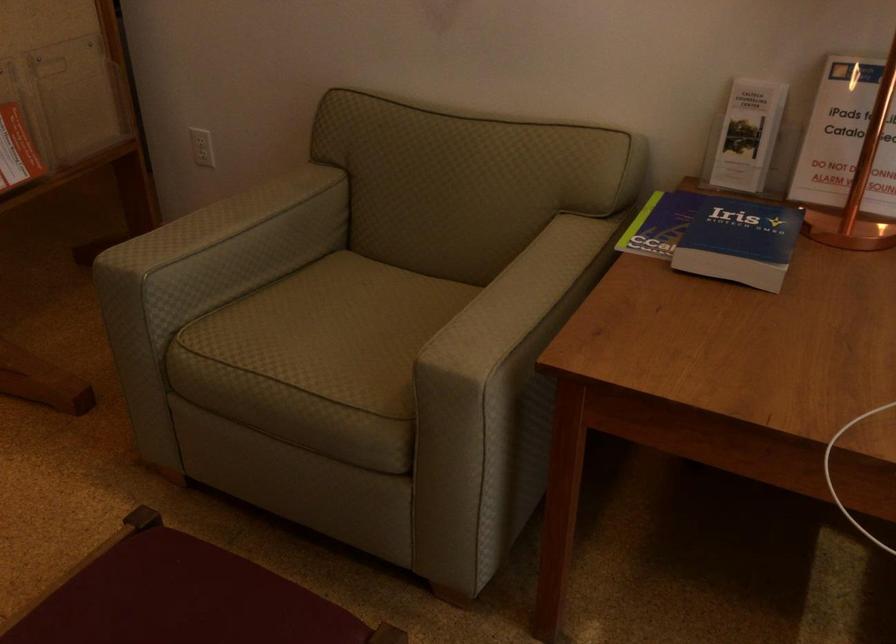
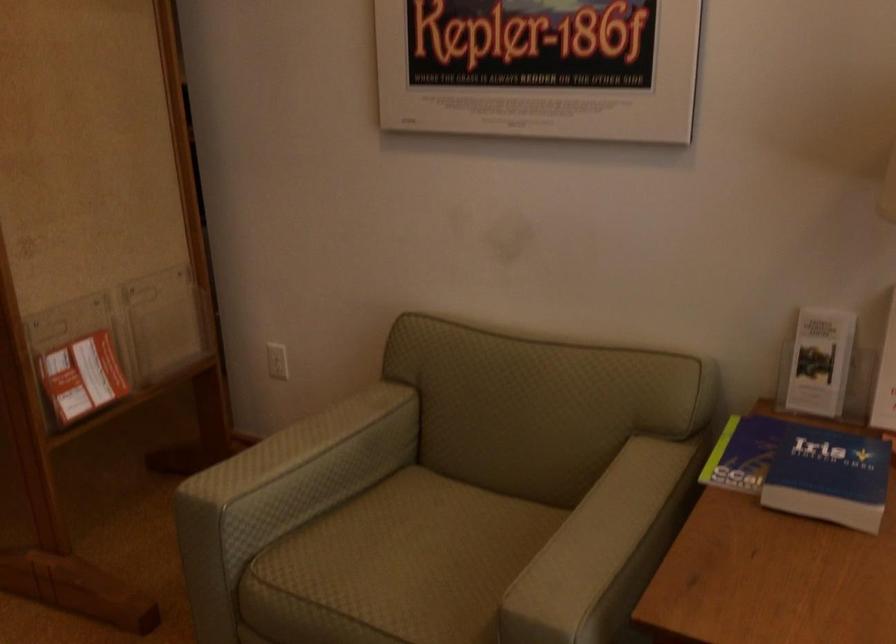
Question: The first image is from the beginning of the video and the second image is from the end. How did the camera likely rotate when shooting the video?

Choices:
 (A) Left
 (B) Right
 (C) Up
 (D) Down

Answer: (C)